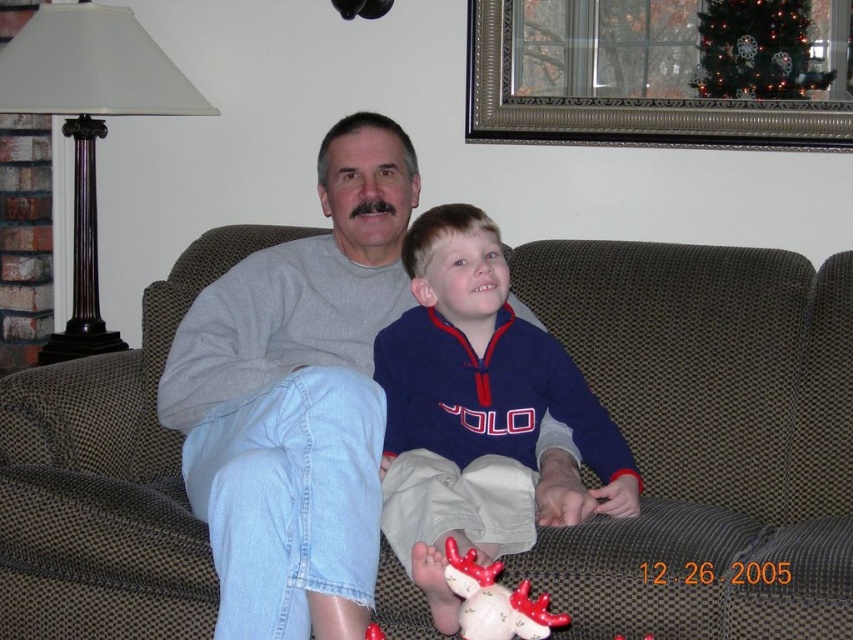
Describe the element at coordinates (474, 408) in the screenshot. This screenshot has width=853, height=640. I see `blue fleece jacket at center` at that location.

This screenshot has width=853, height=640. I want to click on blue fleece jacket at center, so click(474, 408).

Is point (498, 376) farther from camera compared to point (479, 588)?

Yes, it is behind point (479, 588).

Find the location of a particular element. The width and height of the screenshot is (853, 640). blue fleece jacket at center is located at coordinates (474, 408).

Does brown fabric couch at center have a smaller size compared to blue fleece jacket at center?

No.

Which is more to the left, brown fabric couch at center or blue fleece jacket at center?

blue fleece jacket at center

Is point (616, 269) closer to viewer compared to point (404, 435)?

No, it is not.

I want to click on brown fabric couch at center, so 706,438.

Which is more to the right, brown fabric couch at center or gray cotton sweatshirt at center?

brown fabric couch at center

From the picture: Which of these two, brown fabric couch at center or gray cotton sweatshirt at center, stands shorter?

brown fabric couch at center is shorter.

Identify the location of brown fabric couch at center. (706, 438).

Image resolution: width=853 pixels, height=640 pixels. Identify the location of brown fabric couch at center. (706, 438).